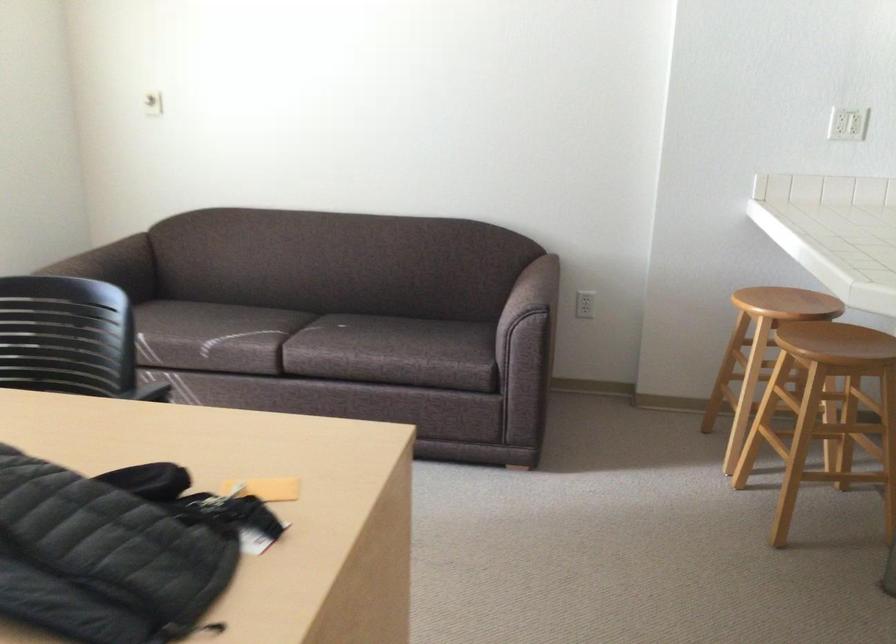
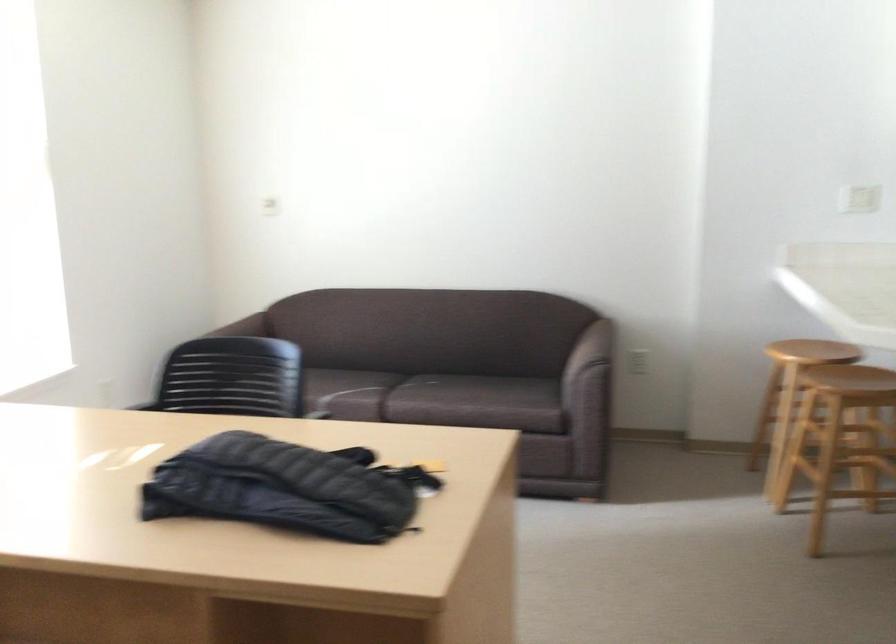
Locate, in the second image, the point that corresponds to point (752, 359) in the first image.

(789, 395)